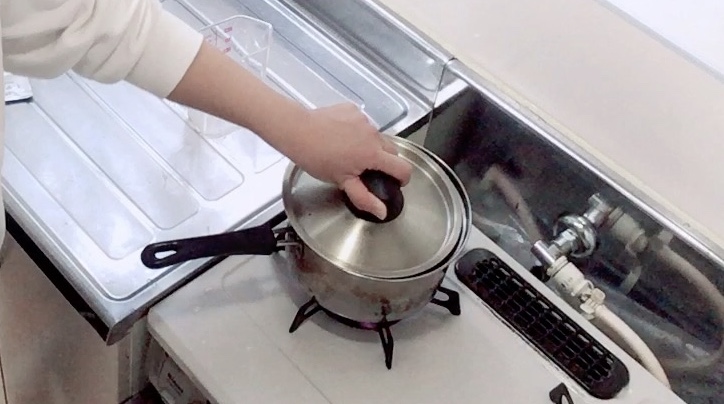
Locate an element on the screen. This screenshot has width=724, height=404. burner is located at coordinates (300, 319).